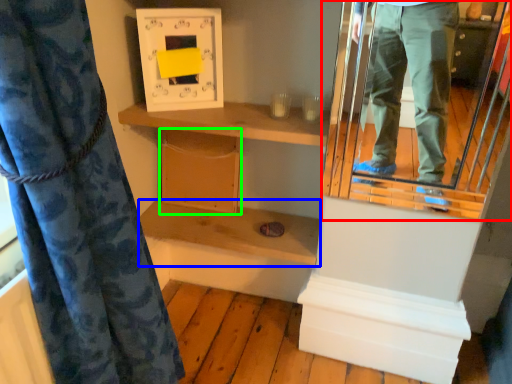
Question: Based on their relative distances, which object is nearer to mirror (highlighted by a red box)? Choose from shelf (highlighted by a blue box) and cabinet (highlighted by a green box).

Choices:
 (A) shelf
 (B) cabinet

Answer: (A)